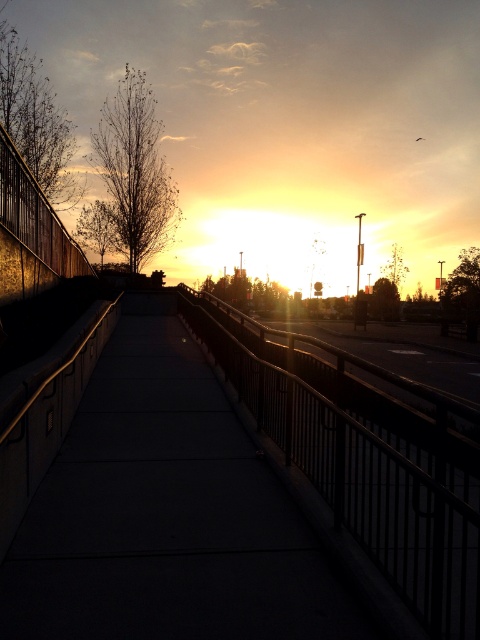
You are a delivery robot on the concrete sidewalk at center. You need to move to the metallic rail at center to pick up a package. Can you reach it from your current position?

The concrete sidewalk at center is located above metallic rail at center, so the robot cannot reach it directly. It would need to move to a position where the metallic rail at center is accessible.